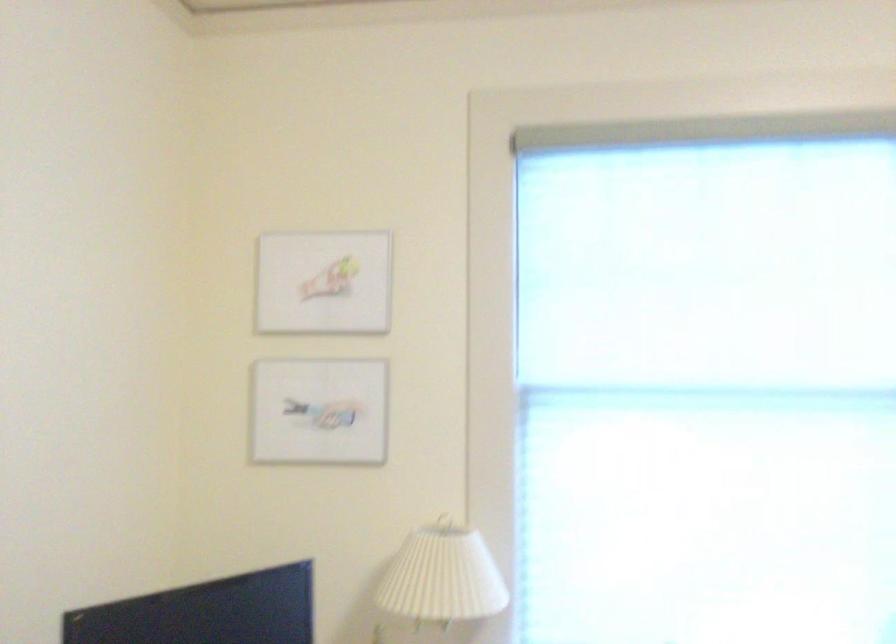
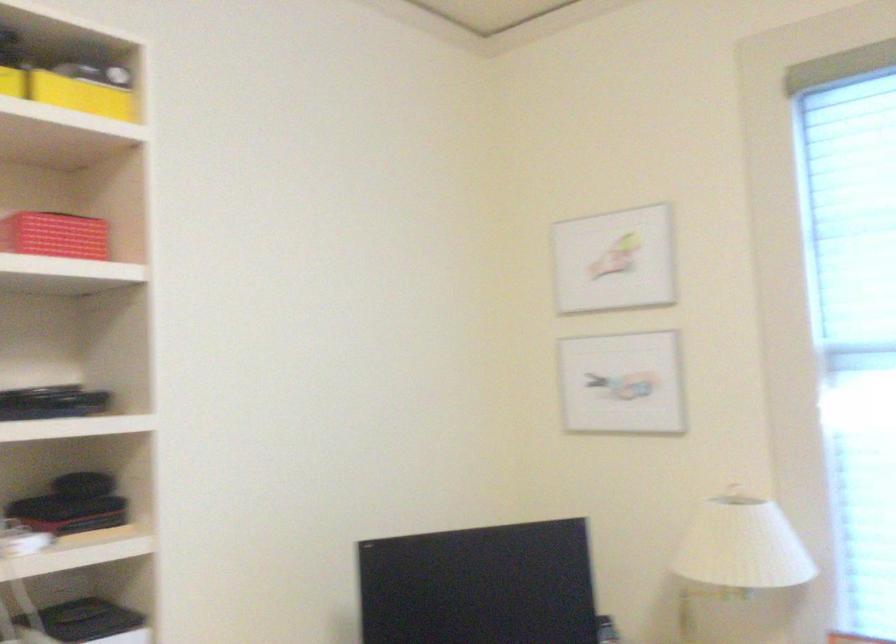
Question: The first image is from the beginning of the video and the second image is from the end. How did the camera likely rotate when shooting the video?

Choices:
 (A) Left
 (B) Right
 (C) Up
 (D) Down

Answer: (A)